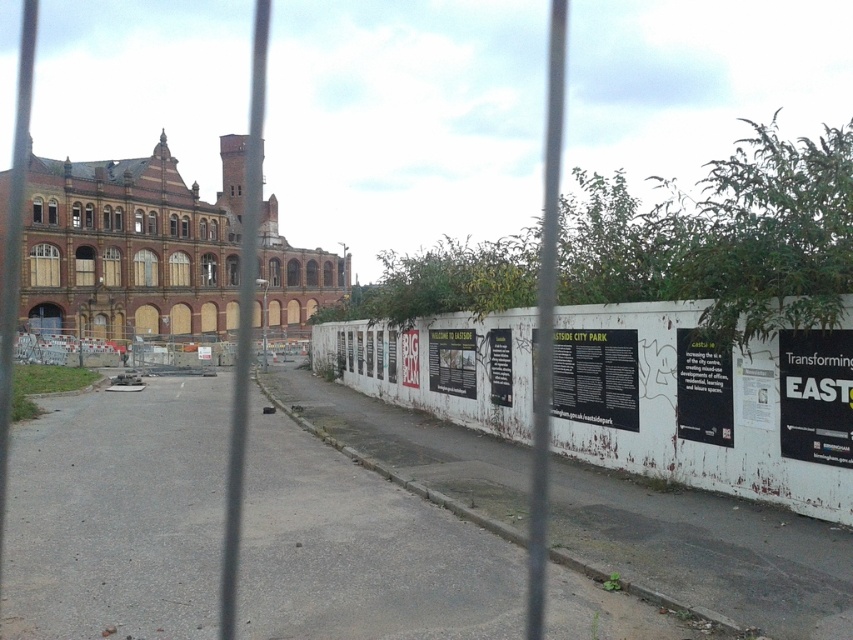
You are a delivery person trying to attach a package to the fence. The package is 1 meter wide. There is space between the green paper poster at center and the white paper poster at center. Can you fit the package there?

The green paper poster at center is narrower than the white paper poster at center. Since the package is 1 meter wide, you need to check the available space between them. However, the description only mentions their widths, not the distance between them. Without knowing the distance between the posters, it is impossible to determine if the package will fit.

You are looking at two posters on a wall through a metal fence. There is a green paper poster at center and a white paper poster at center. Which poster is covering part of the other?

The green paper poster at center is positioned over the white paper poster at center, so it is covering part of it.

You are looking through a metal fence at two posters on a white wall. The posters are both at the center of the image. Which poster can you see more clearly, the green paper poster at center or the white paper poster at center?

The green paper poster at center is closer to the viewer than the white paper poster at center, so the green paper poster at center can be seen more clearly.